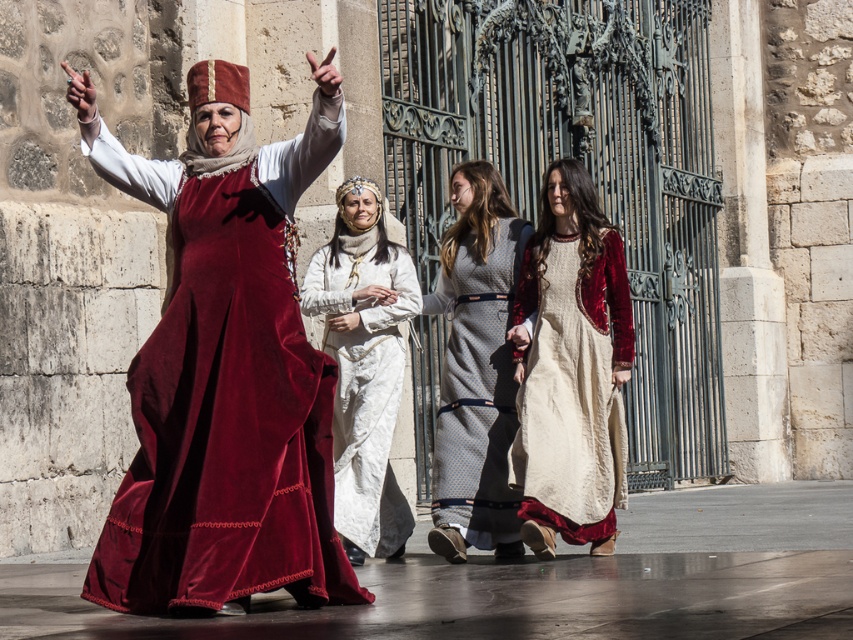
Looking at this image, you are an artist trying to paint the scene. You have two velvet dresses to choose from as references. The velvet dress at left and the velvet gray dress at center. Which dress should you use if you want to depict a thinner figure?

The velvet dress at left is thinner than the velvet gray dress at center, so you should use the velvet dress at left as a reference for a thinner figure.

You are a guest at a medieval festival and see the velvet dress at left and the white silk dress at center. Which dress is taller?

The velvet dress at left is much taller than the white silk dress at center.